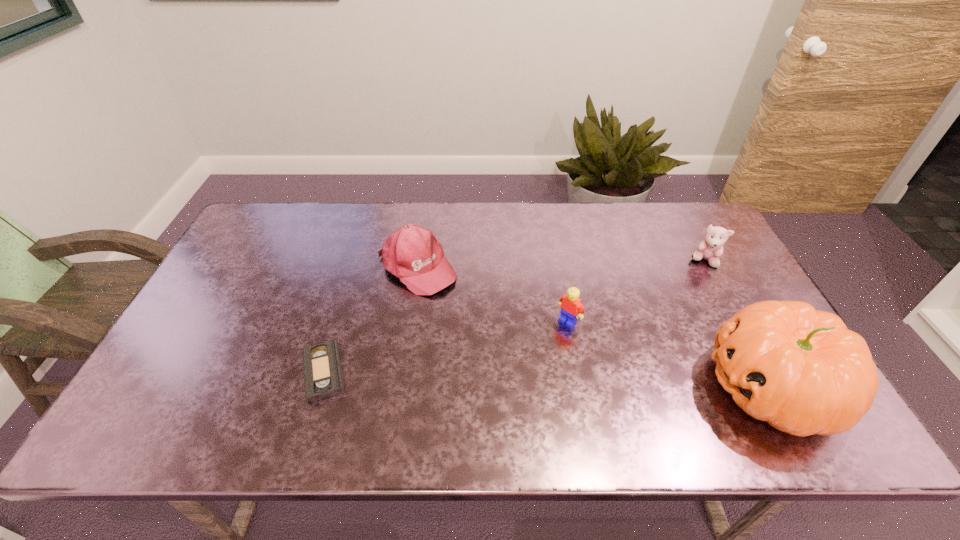
This screenshot has height=540, width=960. What are the coordinates of `vacant spot on the desktop that is between the videotape and the pumpkin and is positioned on the front-facing side of the third nearest object` in the screenshot? It's located at (511, 378).

In order to click on vacant spot on the desktop that is between the shortest object and the tallest object and is positioned at the face of the teddy bear in this screenshot , I will do `click(562, 380)`.

Where is `free space on the desktop that is between the videotape and the pumpkin and is positioned at the front of the baseball cap with the brim`? The width and height of the screenshot is (960, 540). free space on the desktop that is between the videotape and the pumpkin and is positioned at the front of the baseball cap with the brim is located at coordinates (531, 379).